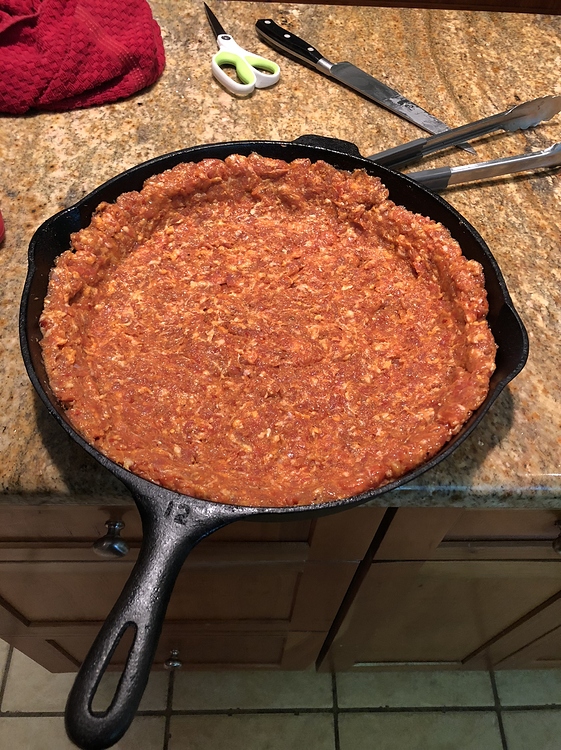
You are a GUI agent. You are given a task and a screenshot of the screen. Output one action in this format:
    pyautogui.click(x=<x>, y=<y>)
    Task: Click on the floor
    This screenshot has width=561, height=750.
    Given the screenshot: What is the action you would take?
    pyautogui.click(x=238, y=698)